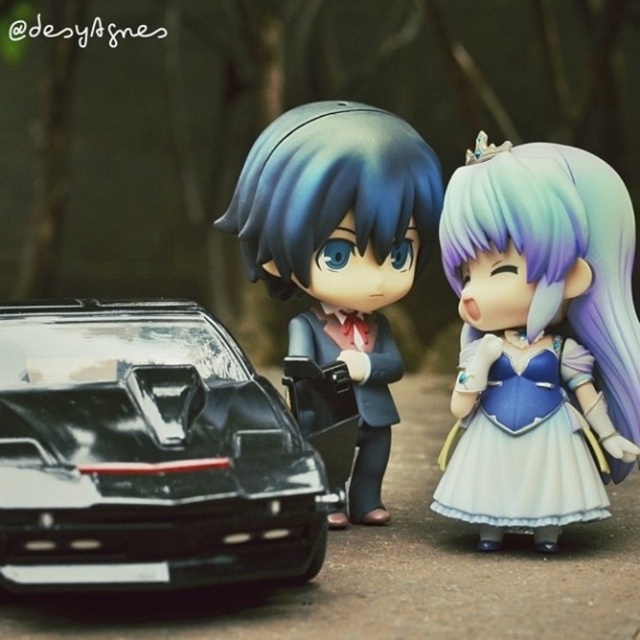
You are an observer standing at the center of the image. There are two points marked in the scene, point (109, 348) and point (502, 490). Which point is closer to you?

Point (109, 348) is in front of point (502, 490), so it is closer to you.

You are standing at the center of the image. Which direction should you move to reach the glossy black car at lower left?

To reach the glossy black car at lower left, you should move towards the lower left direction since its 2D coordinates are at point [147,454].

You are an interior designer planning to place two satin blue dresses in a room. The satin blue dress at right and the satin blue dress at center. Based on the image, which of the two satin blue dresses is shorter in height?

The satin blue dress at right has a lesser height compared to the satin blue dress at center, so the satin blue dress at right is shorter.